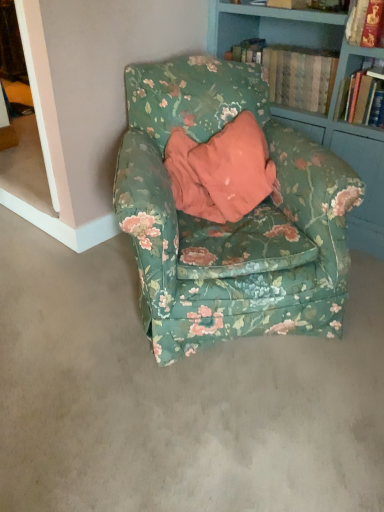
Question: Does point (382, 96) appear closer or farther from the camera than point (241, 55)?

Choices:
 (A) closer
 (B) farther

Answer: (A)

Question: From a real-world perspective, is hardcover book at upper right, placed as the 1th book when sorted from right to left, positioned above or below hardcover book at upper right, the 2th book from the right?

Choices:
 (A) above
 (B) below

Answer: (A)

Question: Which of these objects is positioned farthest from the floral fabric armchair at center?

Choices:
 (A) floral fabric armchair at center
 (B) hardcover book at upper right, the 2th book from the right
 (C) hardcover book at upper right, placed as the 1th book when sorted from right to left

Answer: (C)

Question: Which of these objects is positioned farthest from the hardcover book at upper right, placed as the 1th book when sorted from right to left?

Choices:
 (A) hardcover book at upper right, the 2th book from the right
 (B) floral fabric armchair at center
 (C) floral fabric armchair at center

Answer: (C)